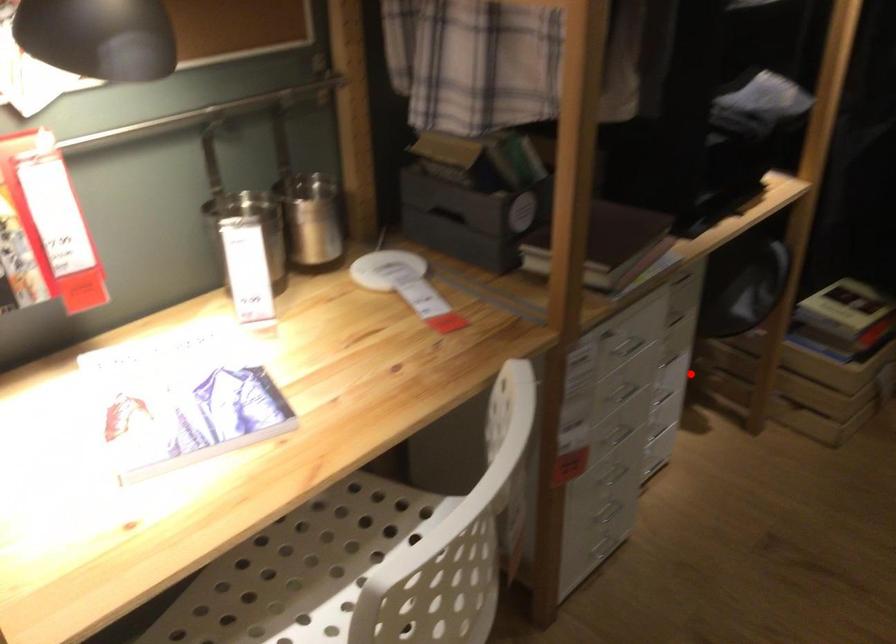
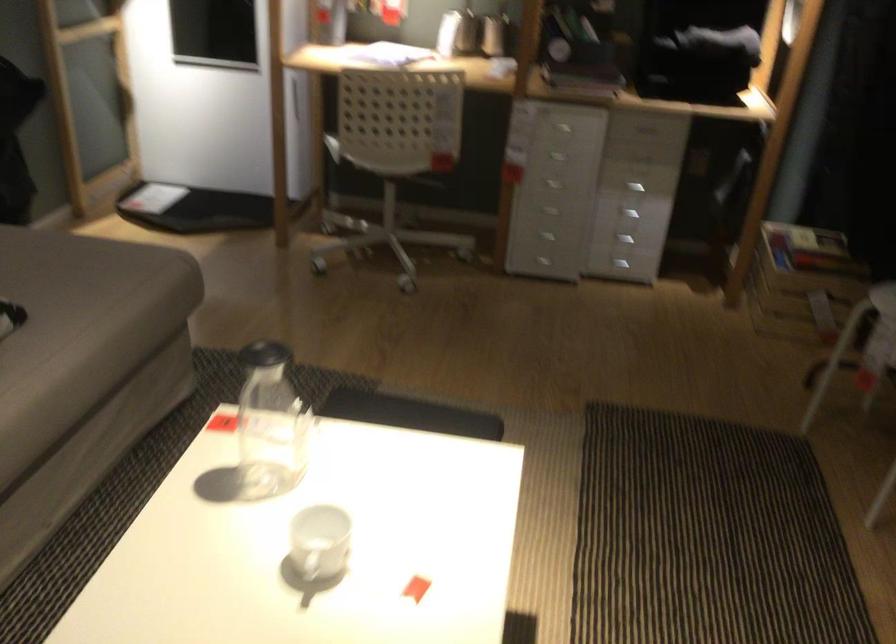
Question: I am providing you with two images of the same scene from different viewpoints. Image1 has a red point marked. In image2, the corresponding 3D location appears at what relative position? Reply with the corresponding letter.

Choices:
 (A) Closer
 (B) Farther

Answer: (B)